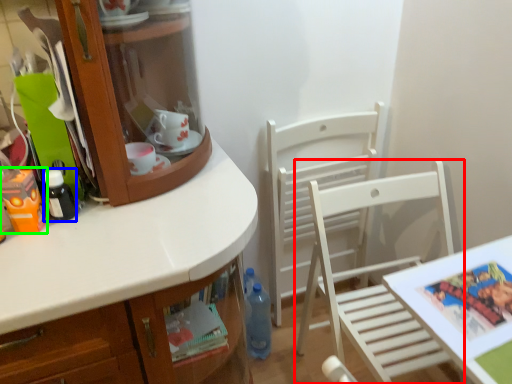
Question: Which is farther away from chair (highlighted by a red box)? bottle (highlighted by a blue box) or toy (highlighted by a green box)?

Choices:
 (A) bottle
 (B) toy

Answer: (B)